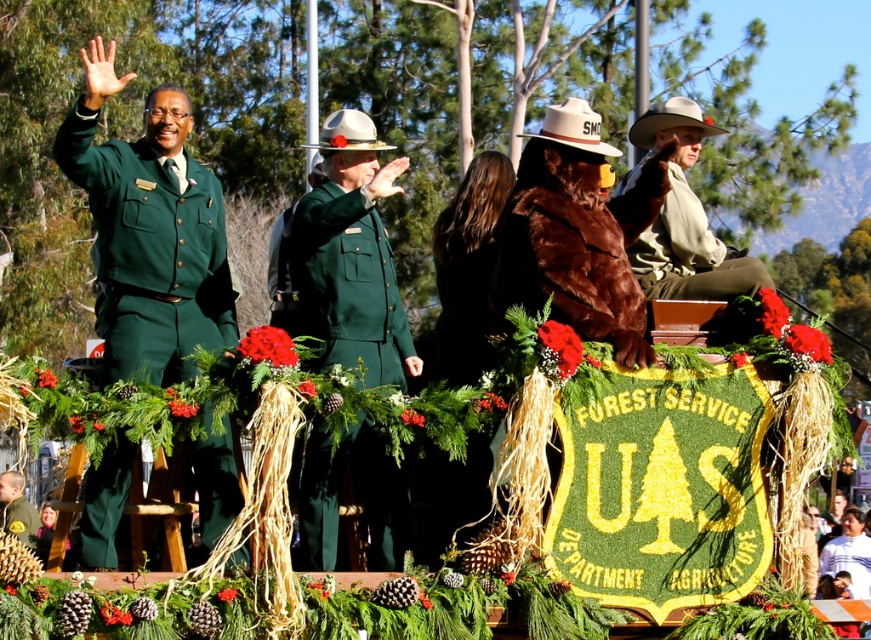
Does green matte uniform at left appear over green matte uniform at center?

Incorrect, green matte uniform at left is not positioned above green matte uniform at center.

Which is more to the right, green matte uniform at left or green matte uniform at center?

From the viewer's perspective, green matte uniform at center appears more on the right side.

Which is in front, point (215, 182) or point (341, 326)?

Positioned in front is point (341, 326).

You are a GUI agent. You are given a task and a screenshot of the screen. Output one action in this format:
    pyautogui.click(x=<x>, y=<y>)
    Task: Click on the green matte uniform at left
    This screenshot has height=640, width=871.
    Given the screenshot: What is the action you would take?
    pyautogui.click(x=152, y=244)

Is green matte uniform at center taller than brown furry bear at center?

Correct, green matte uniform at center is much taller as brown furry bear at center.

Who is more distant from viewer, (377, 483) or (618, 296)?

The point (377, 483) is behind.

This screenshot has height=640, width=871. What are the coordinates of `green matte uniform at center` in the screenshot? It's located at (348, 284).

Between point (377, 288) and point (645, 241), which one is positioned in front?

Point (377, 288) is in front.

Is green matte uniform at center taller than brown fur coat at upper right?

Yes, green matte uniform at center is taller than brown fur coat at upper right.

You are a GUI agent. You are given a task and a screenshot of the screen. Output one action in this format:
    pyautogui.click(x=<x>, y=<y>)
    Task: Click on the green matte uniform at center
    
    Given the screenshot: What is the action you would take?
    pyautogui.click(x=348, y=284)